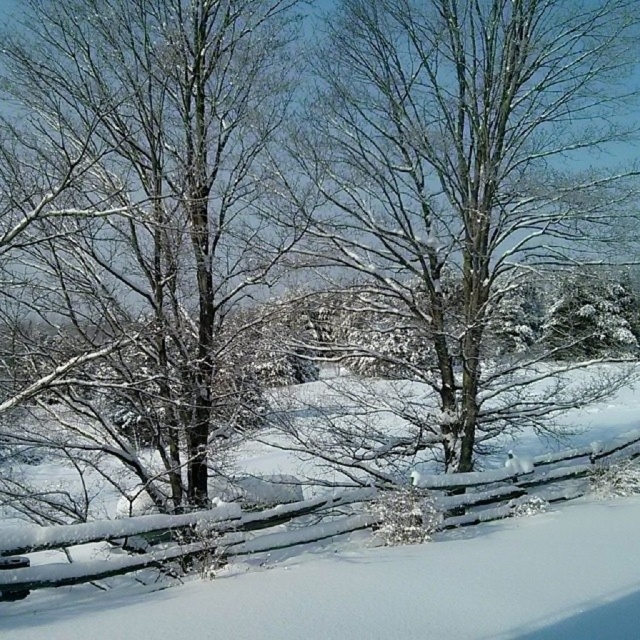
Question: Estimate the real-world distances between objects in this image. Which object is farther from the snow-covered branches at center?

Choices:
 (A) snow-covered tree at center
 (B) wooden at lower left

Answer: (A)

Question: Which point is closer to the camera?

Choices:
 (A) snow-covered tree at center
 (B) wooden at lower left
 (C) snow-covered branches at center

Answer: (B)

Question: Which point appears closest to the camera in this image?

Choices:
 (A) (259, 28)
 (B) (248, 490)
 (C) (291, 166)

Answer: (A)

Question: Is snow-covered branches at center wider than snow-covered tree at center?

Choices:
 (A) yes
 (B) no

Answer: (A)

Question: Is snow-covered branches at center bigger than wooden at lower left?

Choices:
 (A) no
 (B) yes

Answer: (A)

Question: Is snow-covered branches at center below wooden at lower left?

Choices:
 (A) yes
 (B) no

Answer: (B)